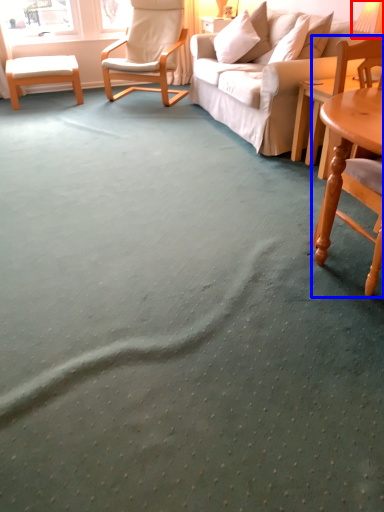
Question: Which point is closer to the camera, table lamp (highlighted by a red box) or chair (highlighted by a blue box)?

Choices:
 (A) table lamp
 (B) chair

Answer: (B)